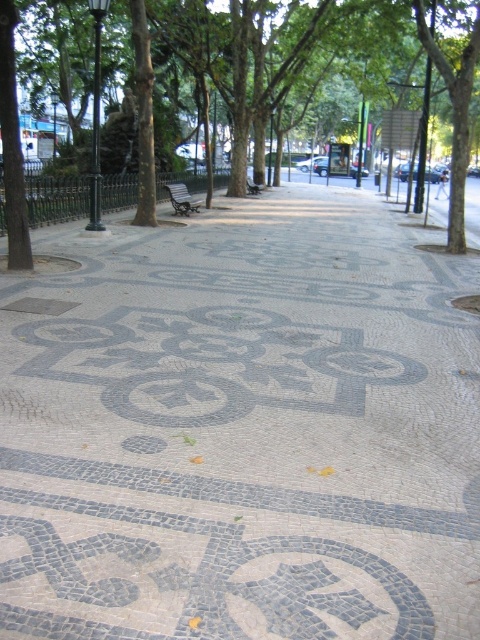
Question: Where is gray mosaic bicycle at center located in relation to wooden park bench at center in the image?

Choices:
 (A) below
 (B) above

Answer: (A)

Question: Among these points, which one is farthest from the camera?

Choices:
 (A) (210, 400)
 (B) (156, 472)
 (C) (326, 113)
 (D) (238, 321)

Answer: (C)

Question: Which object is positioned farthest from the green leafy tree at center?

Choices:
 (A) wooden park bench at center
 (B) gray mosaic tiles at center
 (C) gray mosaic pavement at center

Answer: (B)

Question: From the image, what is the correct spatial relationship of gray mosaic tiles at center in relation to wooden park bench at center?

Choices:
 (A) left
 (B) right

Answer: (B)

Question: Can you confirm if gray mosaic bicycle at center is positioned above gray mosaic tiles at center?

Choices:
 (A) yes
 (B) no

Answer: (A)

Question: Among these points, which one is nearest to the camera?

Choices:
 (A) (452, 170)
 (B) (63, 364)
 (C) (170, 196)

Answer: (B)